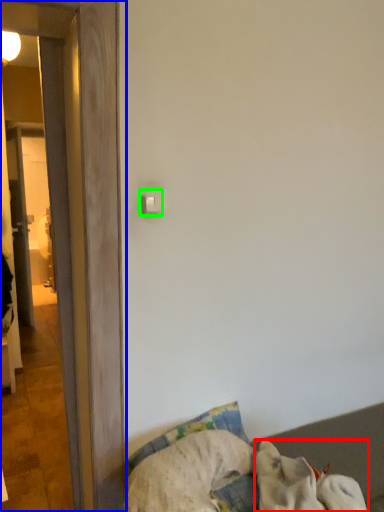
Question: Which is nearer to the dog (highlighted by a red box)? door (highlighted by a blue box) or light switch (highlighted by a green box).

Choices:
 (A) door
 (B) light switch

Answer: (A)